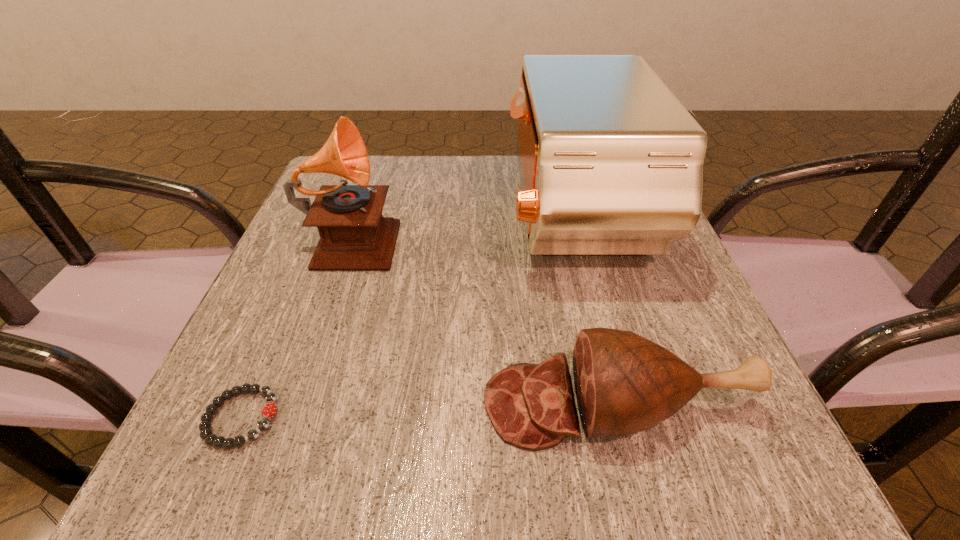
Image resolution: width=960 pixels, height=540 pixels. I want to click on object present at the far left corner, so click(354, 236).

What are the coordinates of `object that is at the near left corner` in the screenshot? It's located at (269, 410).

Locate an element on the screen. object located at the far right corner is located at coordinates click(611, 163).

Locate an element on the screen. This screenshot has height=540, width=960. object at the near right corner is located at coordinates coord(624,383).

Locate an element on the screen. vacant space at the far edge of the desktop is located at coordinates (442, 166).

Where is `vacant space at the near edge`? This screenshot has width=960, height=540. vacant space at the near edge is located at coordinates (314, 447).

In the image, there is a desktop. Where is `vacant space at the left edge`? The image size is (960, 540). vacant space at the left edge is located at coordinates (301, 265).

The height and width of the screenshot is (540, 960). What are the coordinates of `vacant space at the right edge of the desktop` in the screenshot? It's located at (676, 291).

Where is `vacant area between the bracelet and the toaster oven`? The height and width of the screenshot is (540, 960). vacant area between the bracelet and the toaster oven is located at coordinates (407, 317).

You are a GUI agent. You are given a task and a screenshot of the screen. Output one action in this format:
    pyautogui.click(x=<x>, y=<y>)
    Task: Click on the free spot between the shortest object and the phonograph record
    Image resolution: width=960 pixels, height=540 pixels.
    Given the screenshot: What is the action you would take?
    pyautogui.click(x=297, y=327)